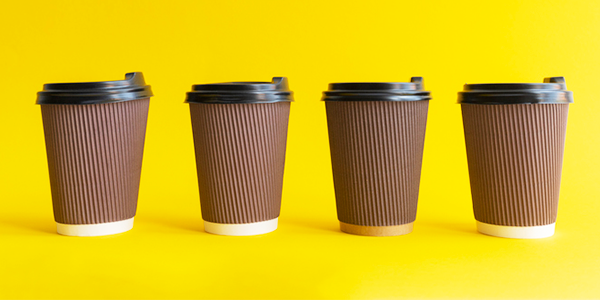
This screenshot has width=600, height=300. Identify the location of bottom of cup. (93, 227), (236, 226), (499, 230), (373, 230).